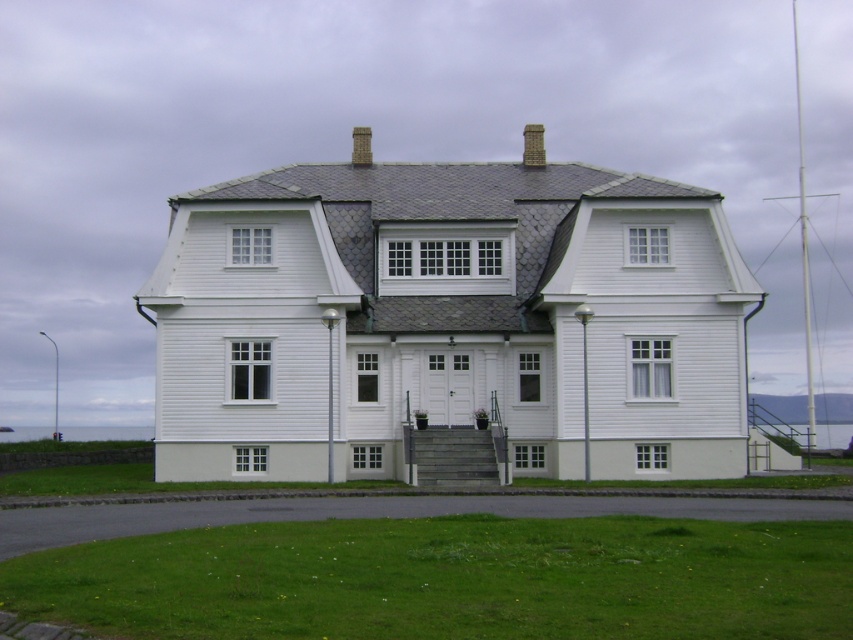
You are a delivery drone that needs to land on the roof of the house to drop off a package. The drone has a GPS system that can navigate to specific coordinates. According to the image, where should the drone aim to land near the gray stone chimney at center?

The gray stone chimney at center is located at coordinates point (448,320), so the drone should aim to land near that point.

Based on the photo, you are standing in front of the house and want to place a birdhouse between the gray stone chimney at center and the brown brick chimney at upper center. Which chimney should the birdhouse be placed closer to in order to be equidistant from both?

The birdhouse should be placed closer to the gray stone chimney at center because it is closer to the viewer than the brown brick chimney at upper center, so positioning it nearer to the closer chimney will maintain equal distance.